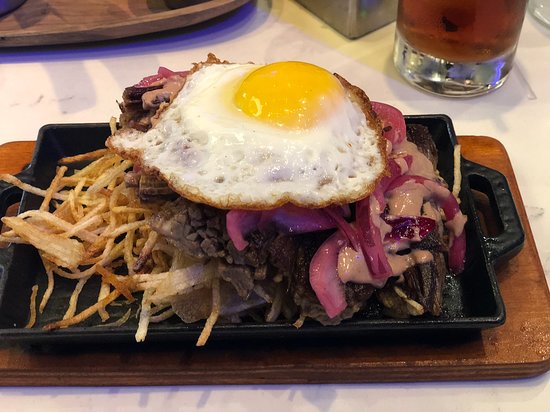
Image resolution: width=550 pixels, height=412 pixels. Find the location of `glass`. glass is located at coordinates (472, 51).